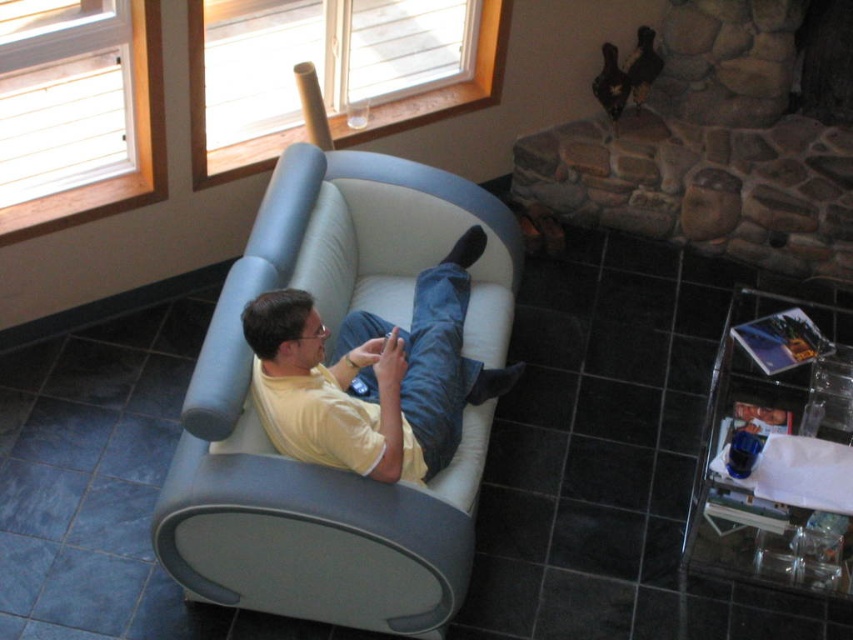
Question: Observing the image, what is the correct spatial positioning of matte gray couch at center in reference to yellow matte shirt at center?

Choices:
 (A) below
 (B) above

Answer: (A)

Question: Is matte gray couch at center to the left of yellow matte shirt at center from the viewer's perspective?

Choices:
 (A) no
 (B) yes

Answer: (B)

Question: Which point is farther to the camera?

Choices:
 (A) coord(448,456)
 (B) coord(339,230)

Answer: (B)

Question: Observing the image, what is the correct spatial positioning of matte gray couch at center in reference to yellow matte shirt at center?

Choices:
 (A) below
 (B) above

Answer: (A)

Question: Among these points, which one is farthest from the camera?

Choices:
 (A) (440, 356)
 (B) (200, 580)

Answer: (A)

Question: Among these points, which one is farthest from the camera?

Choices:
 (A) (436, 604)
 (B) (457, 346)

Answer: (B)